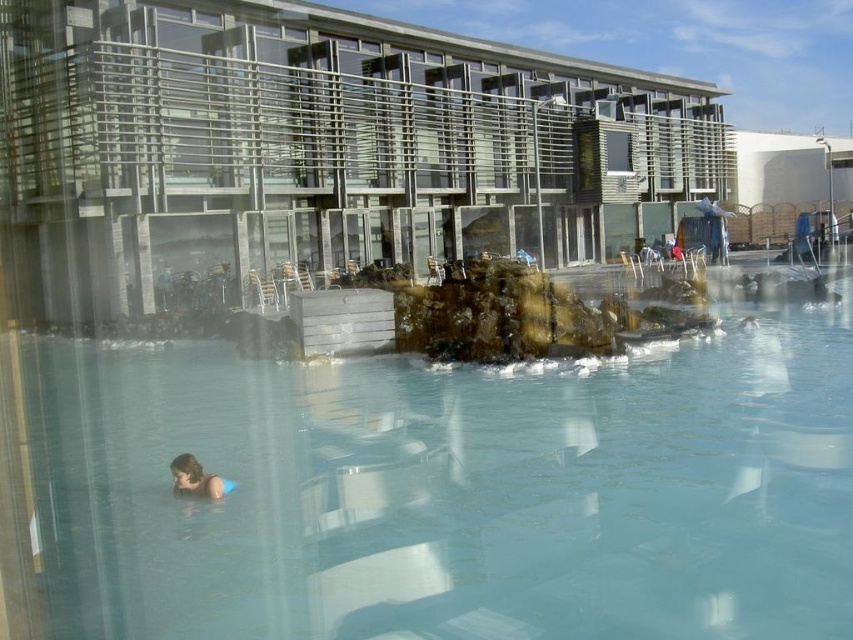
Which is above, clear glass water at center or smooth skin person at lower left?

Positioned higher is clear glass water at center.

You are a GUI agent. You are given a task and a screenshot of the screen. Output one action in this format:
    pyautogui.click(x=<x>, y=<y>)
    Task: Click on the clear glass water at center
    The image size is (853, 640).
    Given the screenshot: What is the action you would take?
    pyautogui.click(x=434, y=492)

The width and height of the screenshot is (853, 640). I want to click on clear glass water at center, so click(x=434, y=492).

Does point (555, 609) lie in front of point (100, 260)?

Yes, point (555, 609) is closer to viewer.

Is clear glass water at center below metallic glass building at center?

Yes, clear glass water at center is below metallic glass building at center.

Is point (224, 460) positioned behind point (358, 67)?

That is False.

What are the coordinates of `clear glass water at center` in the screenshot? It's located at (434, 492).

Is metallic glass building at center to the right of smooth skin person at lower left from the viewer's perspective?

Yes, metallic glass building at center is to the right of smooth skin person at lower left.

Is point (257, 102) in front of point (186, 461)?

No, it is not.

Measure the distance between point (155, 161) and camera.

78.77 feet

The width and height of the screenshot is (853, 640). What are the coordinates of `metallic glass building at center` in the screenshot? It's located at (312, 147).